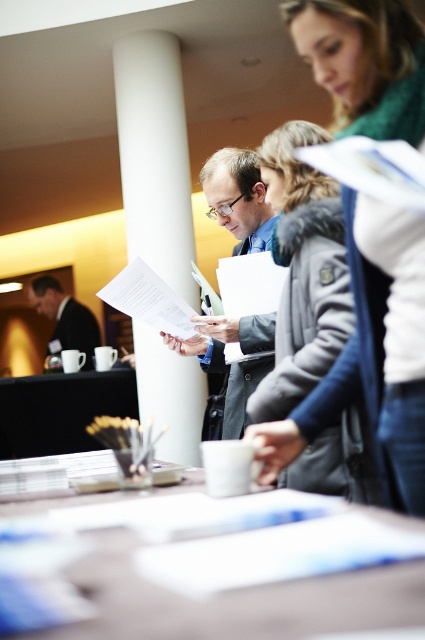
Question: Considering the relative positions of matte black suit at center and black matte table at lower left in the image provided, where is matte black suit at center located with respect to black matte table at lower left?

Choices:
 (A) right
 (B) left

Answer: (A)

Question: Does gray woolen coat at center appear under black matte table at lower left?

Choices:
 (A) yes
 (B) no

Answer: (B)

Question: Considering the relative positions of white smooth column at center and white paper at upper center in the image provided, where is white smooth column at center located with respect to white paper at upper center?

Choices:
 (A) left
 (B) right

Answer: (A)

Question: Which object is closer to the camera taking this photo?

Choices:
 (A) white paper at upper center
 (B) matte black suit at center
 (C) white paper at center

Answer: (A)

Question: Which of the following is the closest to the observer?

Choices:
 (A) (5, 403)
 (B) (283, 582)

Answer: (B)

Question: Which of the following is the closest to the observer?

Choices:
 (A) white paper at upper center
 (B) white smooth column at center
 (C) gray woolen coat at center

Answer: (A)